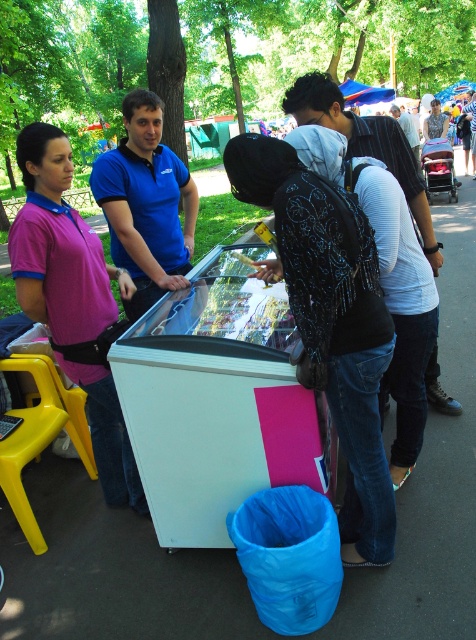
Looking at this image, who is taller, blue cotton polo shirt at center or white textured backpack at center?

With more height is blue cotton polo shirt at center.

Can you confirm if blue cotton polo shirt at center is smaller than white textured backpack at center?

Incorrect, blue cotton polo shirt at center is not smaller in size than white textured backpack at center.

Does point (120, 157) come behind point (328, 120)?

Yes, it is behind point (328, 120).

The height and width of the screenshot is (640, 476). Find the location of `blue cotton polo shirt at center`. blue cotton polo shirt at center is located at coordinates (146, 204).